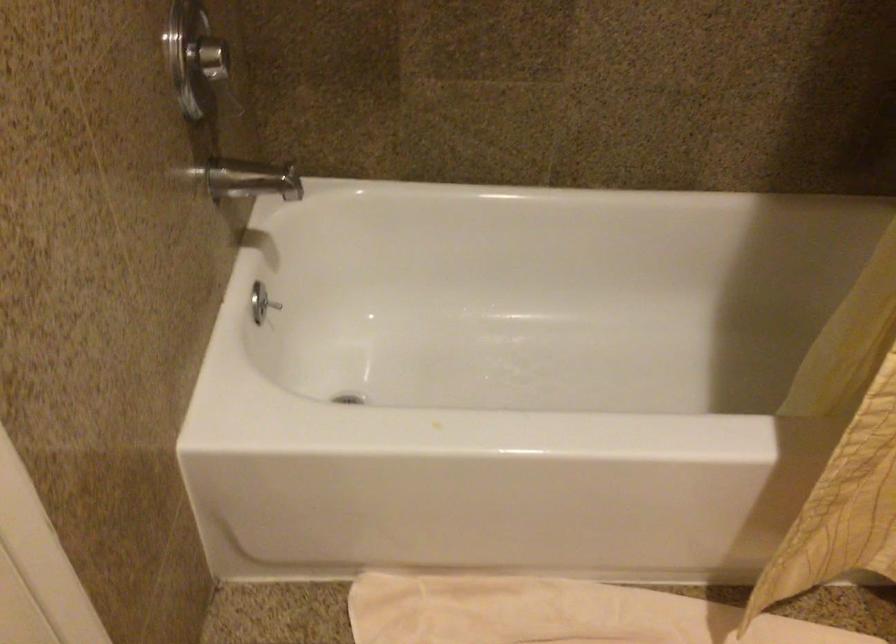
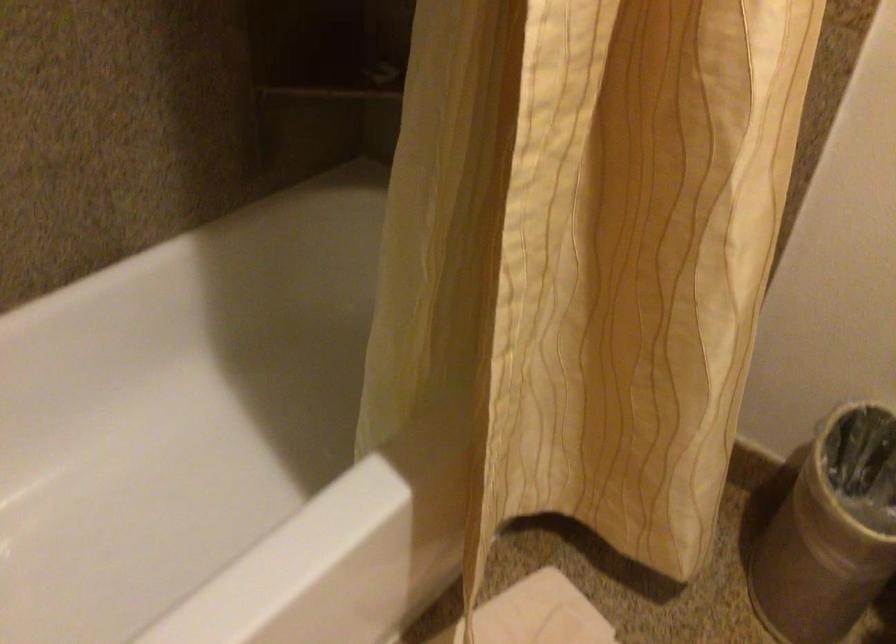
Question: How did the camera likely rotate?

Choices:
 (A) Left
 (B) Right
 (C) Up
 (D) Down

Answer: (B)